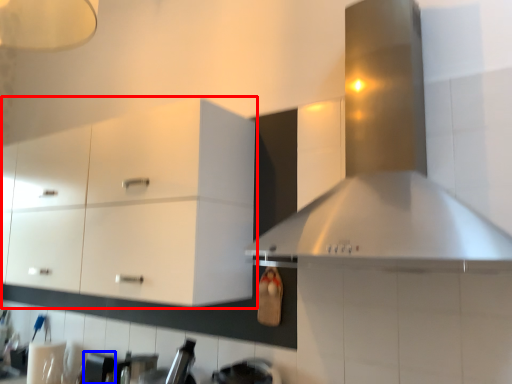
Question: Which object appears farthest to the camera in this image, cabinetry (highlighted by a red box) or appliance (highlighted by a blue box)?

Choices:
 (A) cabinetry
 (B) appliance

Answer: (B)